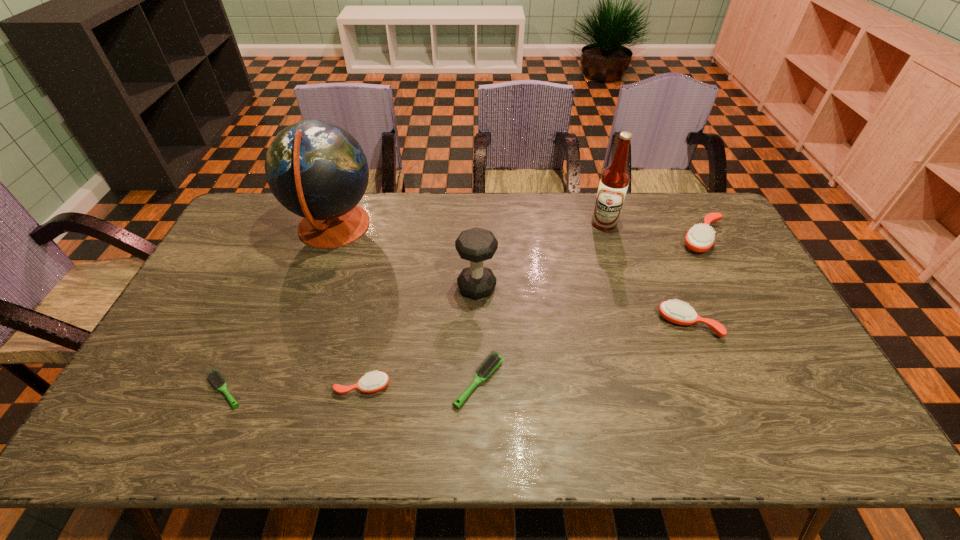
Locate an element on the screen. The image size is (960, 540). free space located on the left of the fourth hairbrush from right to left is located at coordinates (220, 387).

Locate an element on the screen. The width and height of the screenshot is (960, 540). free space located 0.060m on the right of the bigger light hairbrush is located at coordinates (527, 382).

Find the location of a particular element. vacant region located 0.380m on the back of the smaller light hairbrush is located at coordinates (279, 268).

I want to click on globe that is at the far edge, so click(x=317, y=170).

What are the coordinates of `alcohol present at the far edge` in the screenshot? It's located at (614, 181).

Identify the location of hairbrush that is at the far edge. (700, 238).

You are a GUI agent. You are given a task and a screenshot of the screen. Output one action in this format:
    pyautogui.click(x=<x>, y=<y>)
    Task: Click on the object situated at the right edge
    This screenshot has width=960, height=540.
    Given the screenshot: What is the action you would take?
    (x=700, y=238)

Where is `object that is positioned at the far right corner`? The height and width of the screenshot is (540, 960). object that is positioned at the far right corner is located at coordinates (700, 238).

Identify the location of vacant space at the far edge of the desktop. The width and height of the screenshot is (960, 540). (656, 224).

Where is `vacant space at the left edge of the desktop`? The image size is (960, 540). vacant space at the left edge of the desktop is located at coordinates (204, 305).